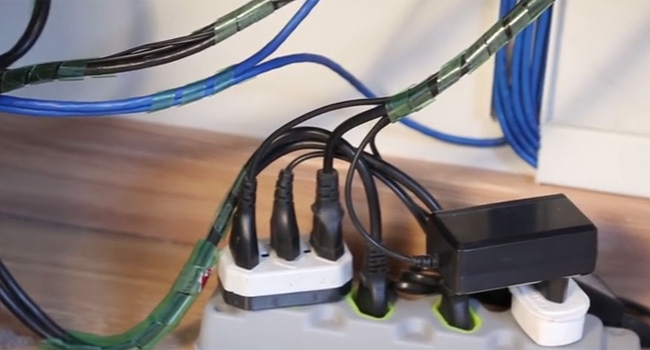
This screenshot has height=350, width=650. I want to click on plugged in cords, so click(x=561, y=294), click(x=550, y=324), click(x=452, y=315), click(x=374, y=308), click(x=327, y=224), click(x=296, y=244), click(x=253, y=245).